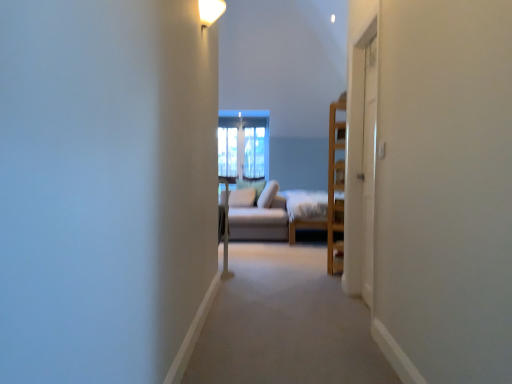
Locate an element on the screen. Image resolution: width=512 pixels, height=384 pixels. vacant space underneath white glossy light fixture at upper center (from a real-world perspective) is located at coordinates (216, 324).